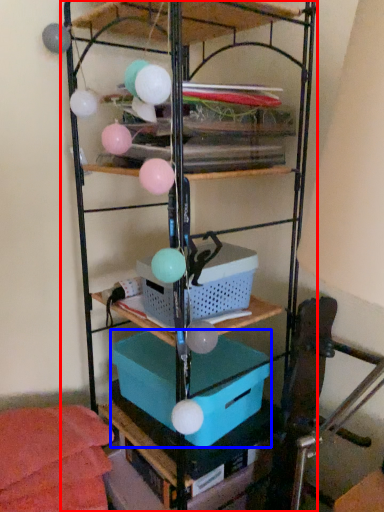
Question: Which point is further to the camera, shelf (highlighted by a red box) or box (highlighted by a blue box)?

Choices:
 (A) shelf
 (B) box

Answer: (B)